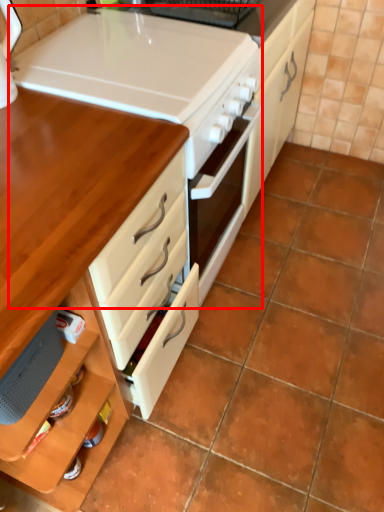
Question: From the image's perspective, considering the relative positions of appliance (annotated by the red box) and table in the image provided, where is appliance (annotated by the red box) located with respect to the staircase?

Choices:
 (A) below
 (B) above

Answer: (B)